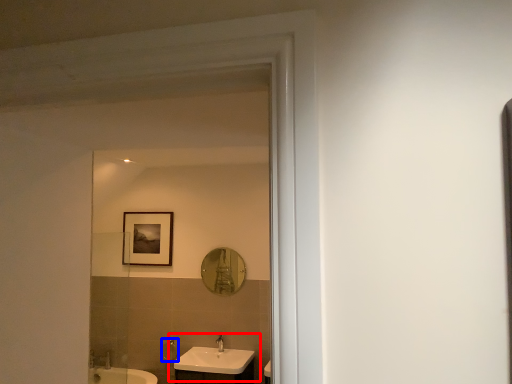
Question: Which object appears closest to the camera in this image, sink (highlighted by a red box) or shower (highlighted by a blue box)?

Choices:
 (A) sink
 (B) shower

Answer: (A)